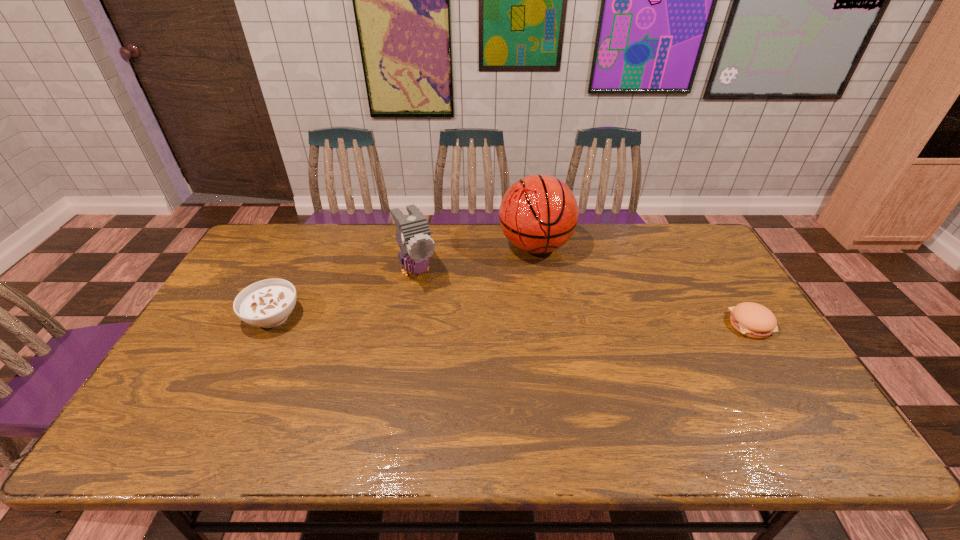
I want to click on blank space that satisfies the following two spatial constraints: 1. on the front side of the third tallest object; 2. on the right side of the rightmost object, so point(269,325).